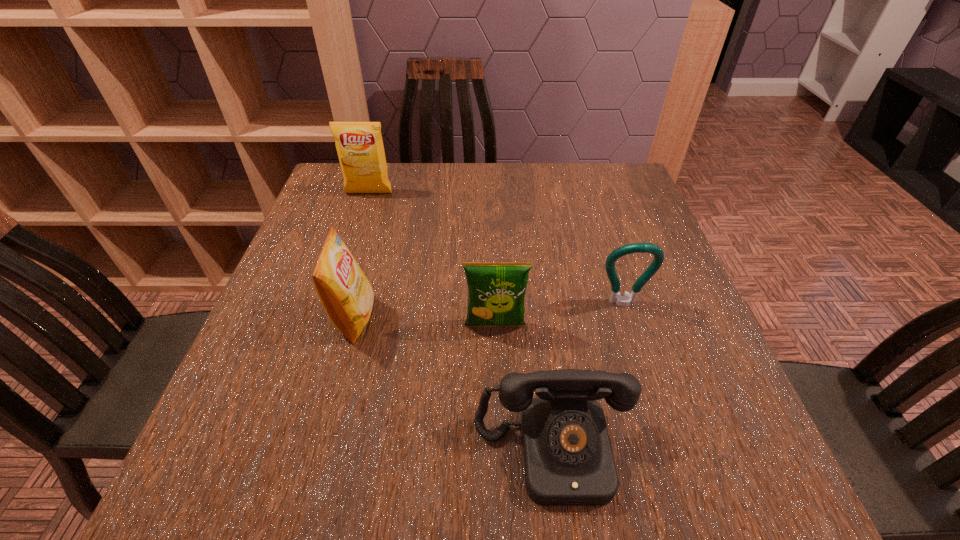
Where is `object positioned at the right edge`? object positioned at the right edge is located at coordinates (623, 301).

The height and width of the screenshot is (540, 960). I want to click on object positioned at the far left corner, so click(359, 145).

The height and width of the screenshot is (540, 960). I want to click on vacant space at the far edge, so click(x=457, y=200).

You are a GUI agent. You are given a task and a screenshot of the screen. Output one action in this format:
    pyautogui.click(x=<x>, y=<y>)
    Task: Click on the free location at the near edge of the desktop
    
    Given the screenshot: What is the action you would take?
    pyautogui.click(x=409, y=498)

Locate an element on the screen. vacant space at the left edge of the desktop is located at coordinates (313, 298).

The height and width of the screenshot is (540, 960). I want to click on free region at the right edge, so click(x=601, y=212).

Where is `vacant space at the far left corner of the desktop`? The image size is (960, 540). vacant space at the far left corner of the desktop is located at coordinates (334, 168).

Find the location of a particular element. free location at the near left corner of the desktop is located at coordinates (206, 478).

Identify the location of vacant space at the far right corner. This screenshot has height=540, width=960. (587, 202).

The image size is (960, 540). I want to click on free space between the rightmost crisp (potato chip) and the rightmost object, so click(x=559, y=315).